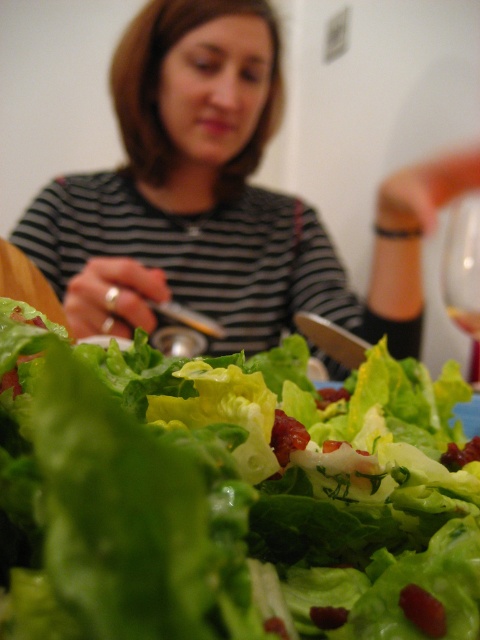
Does point (172, 176) come behind point (466, 321)?

Yes, it is behind point (466, 321).

Can you confirm if striped fabric shirt at upper center is wider than translucent glass wine at center?

Yes, striped fabric shirt at upper center is wider than translucent glass wine at center.

Does point (81, 204) come farther from viewer compared to point (474, 330)?

Yes, point (81, 204) is behind point (474, 330).

Locate an element on the screen. Image resolution: width=480 pixels, height=640 pixels. striped fabric shirt at upper center is located at coordinates (204, 198).

Is point (479, 307) farther from viewer compared to point (477, 320)?

No, it is not.

Does point (446, 237) lie behind point (469, 332)?

Yes, it is.

Where is `transparent glass at upper right`? The height and width of the screenshot is (640, 480). transparent glass at upper right is located at coordinates (463, 260).

Does green leafy lettuce at center have a larger size compared to striped fabric shirt at upper center?

Incorrect, green leafy lettuce at center is not larger than striped fabric shirt at upper center.

Does green leafy lettuce at center appear on the right side of striped fabric shirt at upper center?

Correct, you'll find green leafy lettuce at center to the right of striped fabric shirt at upper center.

Measure the distance between green leafy lettuce at center and camera.

A distance of 5.55 inches exists between green leafy lettuce at center and camera.

You are a GUI agent. You are given a task and a screenshot of the screen. Output one action in this format:
    pyautogui.click(x=<x>, y=<y>)
    Task: Click on the green leafy lettuce at center
    
    Given the screenshot: What is the action you would take?
    pyautogui.click(x=231, y=493)